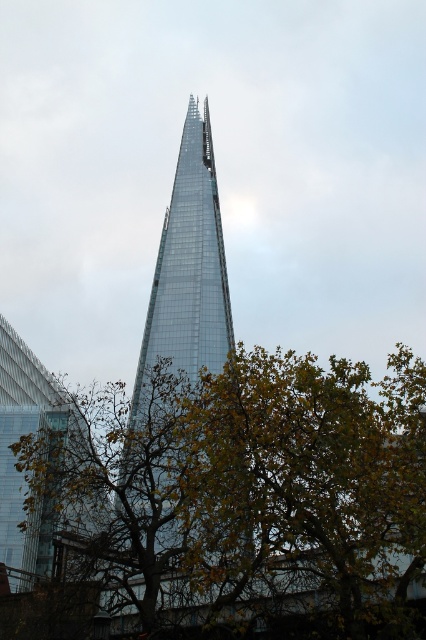
Question: Is green leafy tree at center further to the viewer compared to transparent glass tower at left?

Choices:
 (A) no
 (B) yes

Answer: (A)

Question: Which point is closer to the camera?

Choices:
 (A) green leafy tree at center
 (B) transparent glass tower at left

Answer: (A)

Question: Does green leafy tree at center have a smaller size compared to transparent glass tower at left?

Choices:
 (A) yes
 (B) no

Answer: (B)

Question: Does green leafy tree at center lie behind transparent glass tower at left?

Choices:
 (A) no
 (B) yes

Answer: (A)